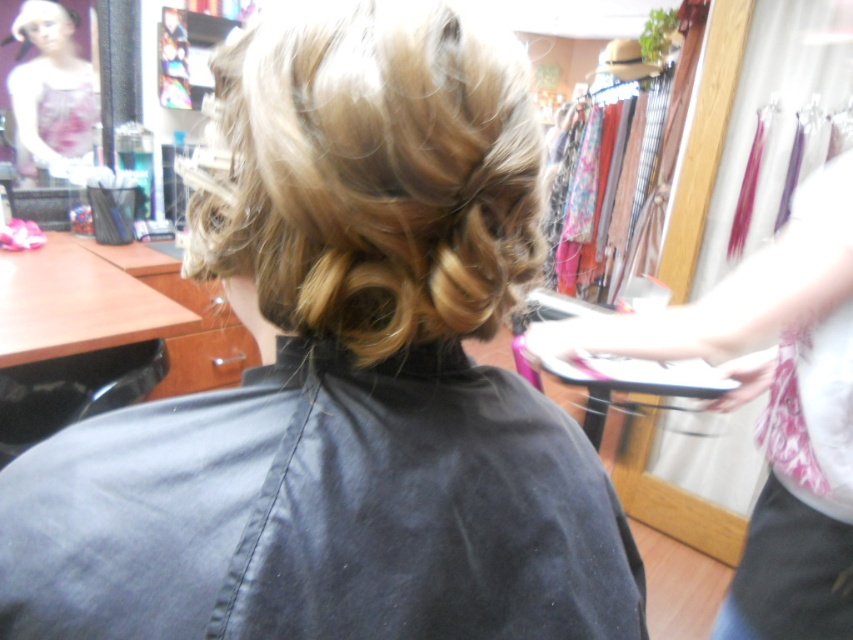
Question: Is the position of blonde curly hair at center more distant than that of matte floral apron at upper left?

Choices:
 (A) no
 (B) yes

Answer: (A)

Question: Which is nearer to the blonde curly hair at center?

Choices:
 (A) matte floral apron at upper left
 (B) white fabric at right

Answer: (B)

Question: Is white fabric at right to the right of matte floral apron at upper left from the viewer's perspective?

Choices:
 (A) no
 (B) yes

Answer: (B)

Question: Which object is positioned farthest from the white fabric at right?

Choices:
 (A) blonde curly hair at center
 (B) matte floral apron at upper left

Answer: (B)

Question: Which of these objects is positioned farthest from the matte floral apron at upper left?

Choices:
 (A) white fabric at right
 (B) blonde curly hair at center

Answer: (B)

Question: Does white fabric at right lie in front of matte floral apron at upper left?

Choices:
 (A) yes
 (B) no

Answer: (A)